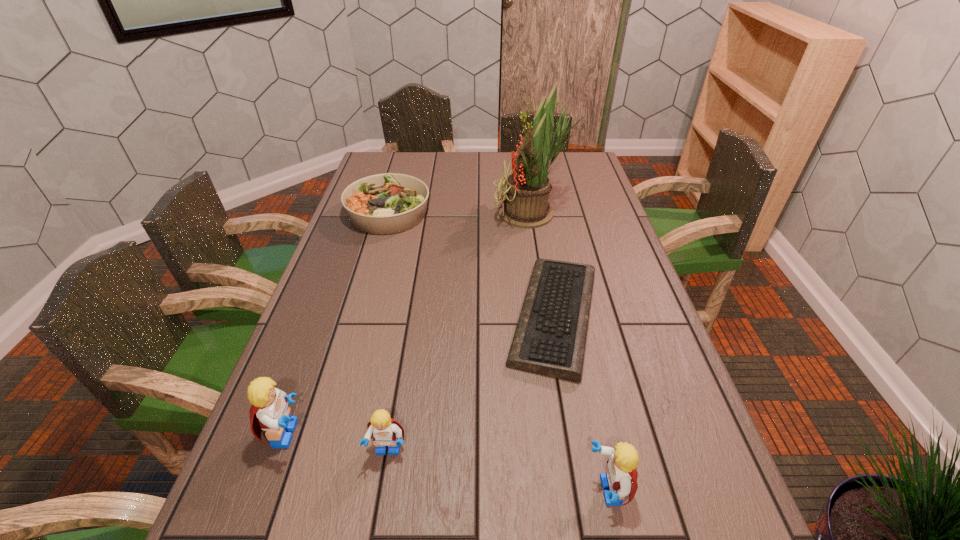
At what (x,y) coordinates should I click in order to perform the action: click on free spot between the third farthest object and the shortest Lego. Please return your answer as a coordinate pair (x, y). The width and height of the screenshot is (960, 540). Looking at the image, I should click on (471, 384).

The height and width of the screenshot is (540, 960). I want to click on free space that is in between the fourth shortest object and the shortest object, so click(581, 403).

Where is `vacant area that lies between the salad plate and the computer keyboard`? vacant area that lies between the salad plate and the computer keyboard is located at coordinates (471, 265).

You are a GUI agent. You are given a task and a screenshot of the screen. Output one action in this format:
    pyautogui.click(x=<x>, y=<y>)
    Task: Click on the object that is the closest one to the shortest object
    This screenshot has height=540, width=960.
    Given the screenshot: What is the action you would take?
    click(527, 189)

The width and height of the screenshot is (960, 540). What are the coordinates of `object that is the closest to the second Lego from left to right` in the screenshot? It's located at (270, 412).

Image resolution: width=960 pixels, height=540 pixels. Find the location of `Lego that is the second closest to the fourth shortest object`. Lego that is the second closest to the fourth shortest object is located at coordinates (270, 412).

Locate an element on the screen. The width and height of the screenshot is (960, 540). Lego that is the nearest to the leftmost Lego is located at coordinates (386, 431).

The height and width of the screenshot is (540, 960). I want to click on vacant space that satisfies the following two spatial constraints: 1. in front of the flower arrangement with the fan visible; 2. on the right side of the third farthest object, so click(549, 316).

I want to click on free space that satisfies the following two spatial constraints: 1. in front of the flower arrangement with the fan visible; 2. on the front-facing side of the second Lego from right to left, so click(571, 451).

The width and height of the screenshot is (960, 540). Find the location of `vacant position in the image that satisfies the following two spatial constraints: 1. in front of the tallest object with the fan visible; 2. on the back side of the fourth nearest object`. vacant position in the image that satisfies the following two spatial constraints: 1. in front of the tallest object with the fan visible; 2. on the back side of the fourth nearest object is located at coordinates (549, 316).